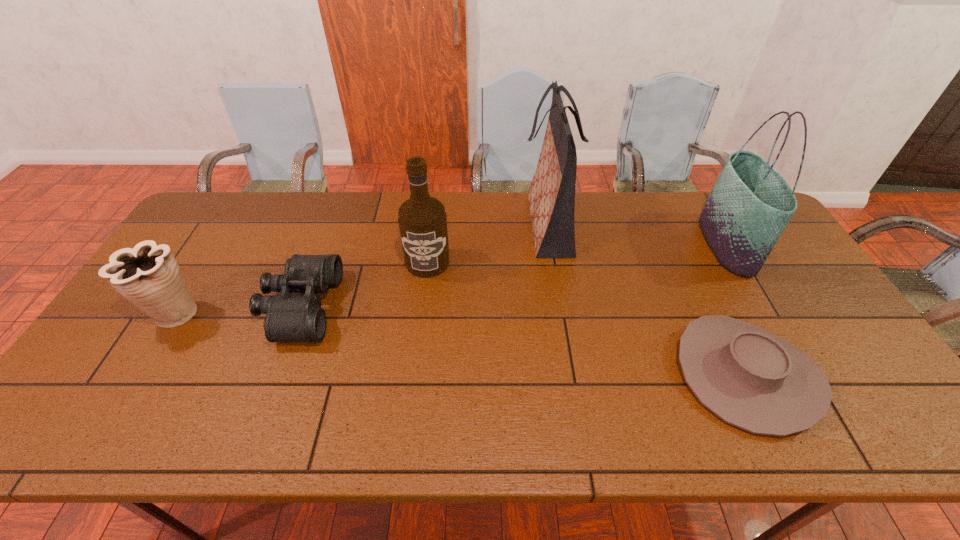
Locate an element on the screen. object at the left edge is located at coordinates (148, 275).

Image resolution: width=960 pixels, height=540 pixels. In order to click on tote bag present at the right edge in this screenshot , I will do `click(750, 204)`.

Locate an element on the screen. cowboy hat located in the right edge section of the desktop is located at coordinates (750, 378).

At what (x,y) coordinates should I click in order to perform the action: click on object present at the far right corner. Please return your answer as a coordinate pair (x, y). The width and height of the screenshot is (960, 540). Looking at the image, I should click on (750, 204).

Locate an element on the screen. The width and height of the screenshot is (960, 540). object present at the near right corner is located at coordinates (750, 378).

At what (x,y) coordinates should I click in order to perform the action: click on blank area at the far edge. Please return your answer as a coordinate pair (x, y). The image size is (960, 540). Looking at the image, I should click on (681, 206).

You are a GUI agent. You are given a task and a screenshot of the screen. Output one action in this format:
    pyautogui.click(x=<x>, y=<y>)
    Task: Click on the free point at the left edge
    
    Given the screenshot: What is the action you would take?
    point(181,260)

Where is `vacant area at the right edge`? vacant area at the right edge is located at coordinates (766, 284).

Find the location of `blank space at the far left corner`. blank space at the far left corner is located at coordinates (256, 192).

Where is `vacant space at the near right corner of the desktop`? vacant space at the near right corner of the desktop is located at coordinates (876, 432).